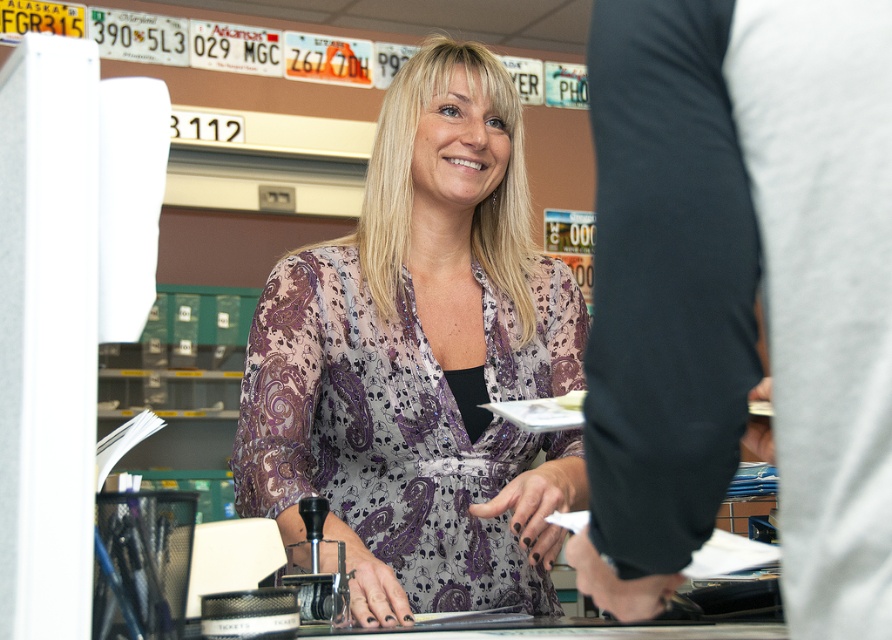
Question: Is white fabric pants at lower right positioned in front of purple paisley blouse at center?

Choices:
 (A) no
 (B) yes

Answer: (B)

Question: Among these points, which one is nearest to the camera?

Choices:
 (A) (449, 170)
 (B) (855, 284)

Answer: (B)

Question: Does white fabric pants at lower right appear over purple paisley blouse at center?

Choices:
 (A) yes
 (B) no

Answer: (B)

Question: Does white fabric pants at lower right come in front of purple paisley blouse at center?

Choices:
 (A) yes
 (B) no

Answer: (A)